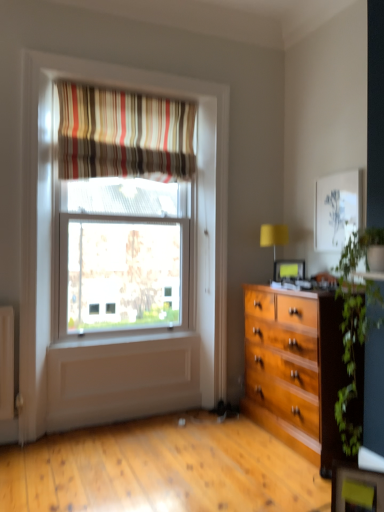
Question: Is the position of yellow fabric lampshade at right less distant than that of striped fabric curtain at upper center?

Choices:
 (A) no
 (B) yes

Answer: (A)

Question: Is yellow fabric lampshade at right far away from striped fabric curtain at upper center?

Choices:
 (A) no
 (B) yes

Answer: (B)

Question: Does yellow fabric lampshade at right have a greater height compared to striped fabric curtain at upper center?

Choices:
 (A) no
 (B) yes

Answer: (A)

Question: Does yellow fabric lampshade at right appear on the right side of striped fabric curtain at upper center?

Choices:
 (A) no
 (B) yes

Answer: (B)

Question: From the image's perspective, is yellow fabric lampshade at right on top of striped fabric curtain at upper center?

Choices:
 (A) no
 (B) yes

Answer: (A)

Question: From a real-world perspective, is striped fabric curtain at upper center positioned above or below yellow fabric lampshade at right?

Choices:
 (A) below
 (B) above

Answer: (B)

Question: In terms of size, does striped fabric curtain at upper center appear bigger or smaller than yellow fabric lampshade at right?

Choices:
 (A) big
 (B) small

Answer: (A)

Question: Relative to yellow fabric lampshade at right, is striped fabric curtain at upper center in front or behind?

Choices:
 (A) front
 (B) behind

Answer: (A)

Question: From the image's perspective, relative to yellow fabric lampshade at right, is striped fabric curtain at upper center above or below?

Choices:
 (A) above
 (B) below

Answer: (A)

Question: Is green leafy plant at right situated inside striped fabric curtain at upper center or outside?

Choices:
 (A) inside
 (B) outside

Answer: (B)

Question: Considering the positions of point (349, 452) and point (104, 119), is point (349, 452) closer or farther from the camera than point (104, 119)?

Choices:
 (A) closer
 (B) farther

Answer: (A)

Question: Considering the positions of green leafy plant at right and striped fabric curtain at upper center in the image, is green leafy plant at right taller or shorter than striped fabric curtain at upper center?

Choices:
 (A) tall
 (B) short

Answer: (A)

Question: From a real-world perspective, relative to striped fabric curtain at upper center, is green leafy plant at right vertically above or below?

Choices:
 (A) below
 (B) above

Answer: (A)

Question: In terms of height, does green leafy plant at right look taller or shorter compared to matte black picture frame at center?

Choices:
 (A) tall
 (B) short

Answer: (A)

Question: Does point (352, 389) appear closer or farther from the camera than point (279, 281)?

Choices:
 (A) closer
 (B) farther

Answer: (A)